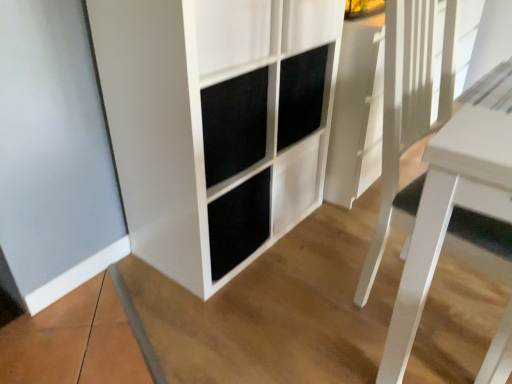
Question: From the image's perspective, relative to white matte cabinet at center, is white glossy table at right above or below?

Choices:
 (A) below
 (B) above

Answer: (A)

Question: Choose the correct answer: Is white glossy table at right inside white matte cabinet at center or outside it?

Choices:
 (A) outside
 (B) inside

Answer: (A)

Question: Considering the relative positions of white glossy table at right and white matte cabinet at center in the image provided, is white glossy table at right to the left or to the right of white matte cabinet at center?

Choices:
 (A) left
 (B) right

Answer: (B)

Question: Considering their positions, is white matte cabinet at center located in front of or behind white glossy table at right?

Choices:
 (A) behind
 (B) front

Answer: (A)

Question: From a real-world perspective, is white matte cabinet at center positioned above or below white glossy table at right?

Choices:
 (A) below
 (B) above

Answer: (B)

Question: Based on their positions, is white matte cabinet at center located to the left or right of white glossy table at right?

Choices:
 (A) right
 (B) left

Answer: (B)

Question: From the image's perspective, is white matte cabinet at center above or below white glossy table at right?

Choices:
 (A) above
 (B) below

Answer: (A)